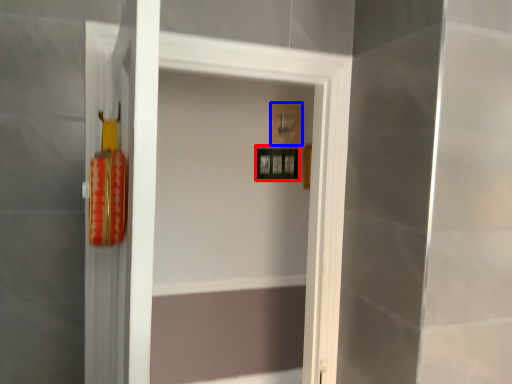
Question: Which object appears closest to the camera in this image, picture frame (highlighted by a red box) or picture frame (highlighted by a blue box)?

Choices:
 (A) picture frame
 (B) picture frame

Answer: (A)